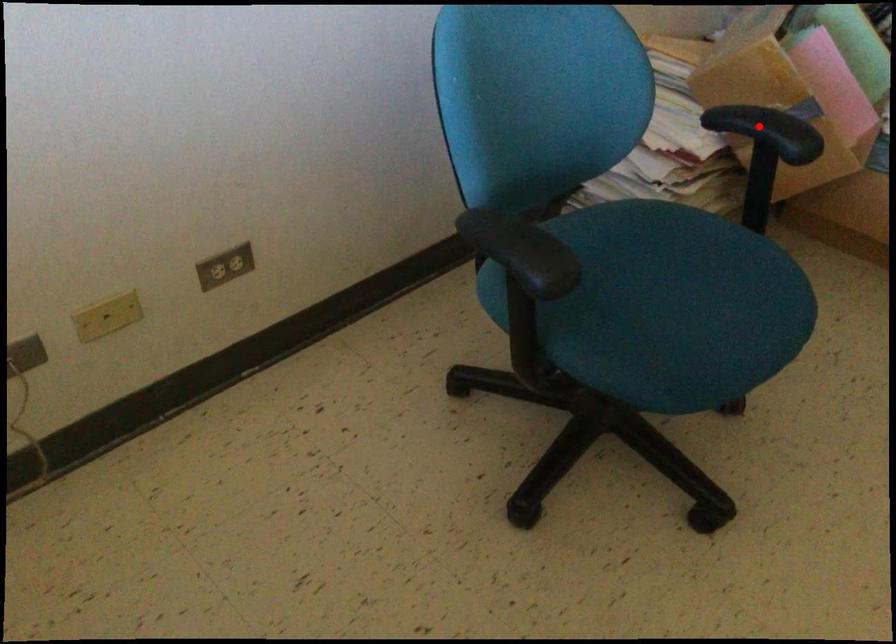
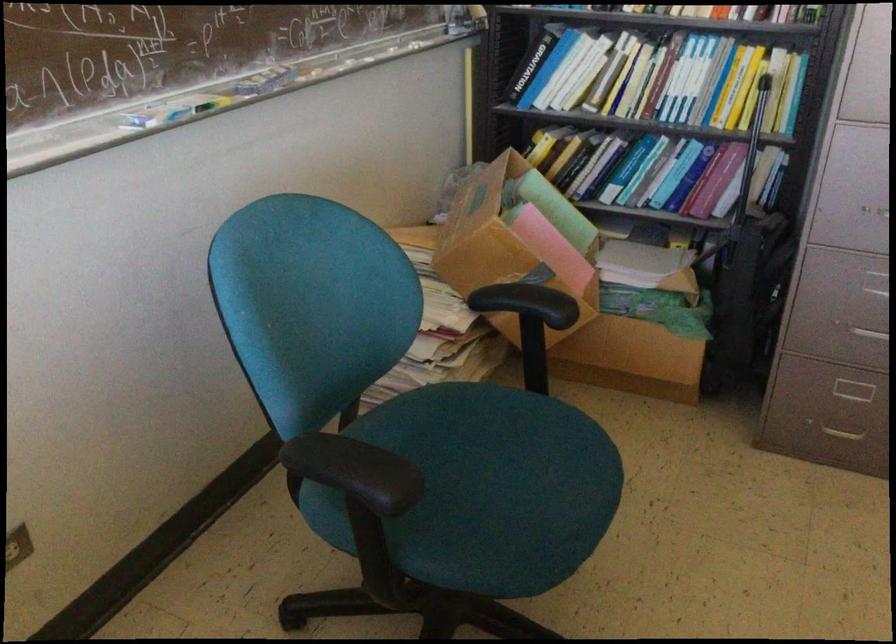
Where in the second image is the point corresponding to the highlighted location from the first image?

(527, 303)